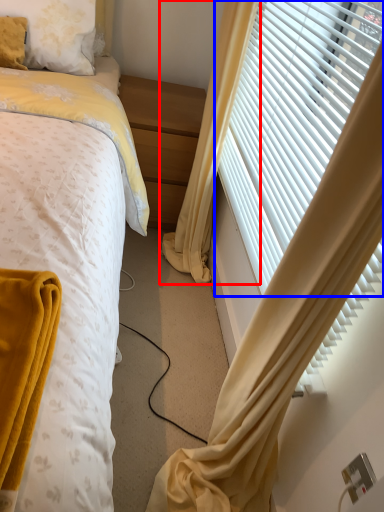
Question: Among these objects, which one is farthest to the camera, curtain (highlighted by a red box) or window blind (highlighted by a blue box)?

Choices:
 (A) curtain
 (B) window blind

Answer: (A)